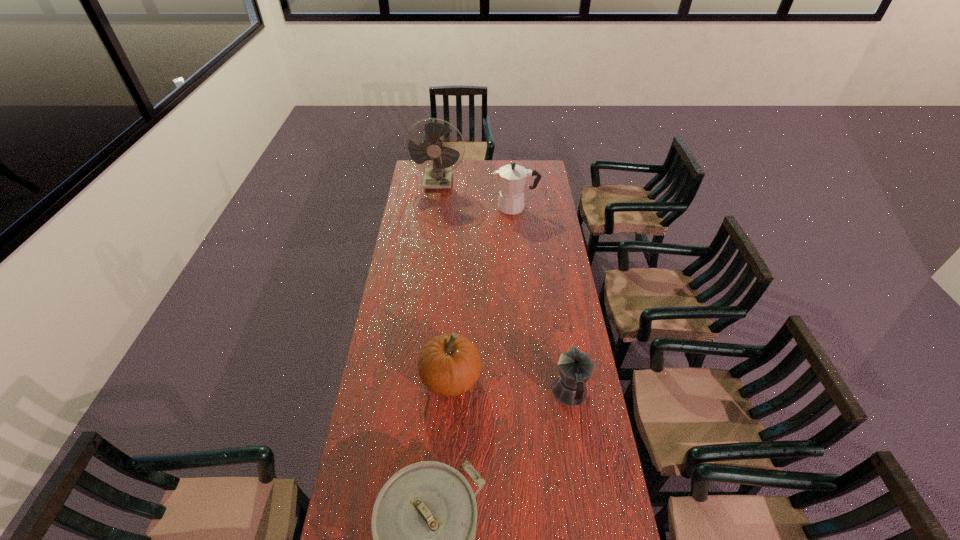
Identify the location of vacant space that satisfies the following two spatial constraints: 1. at the spout of the nearer coffeepot; 2. at the spout of the taller coffeepot. (540, 207).

The image size is (960, 540). Find the location of `free point that satisfies the following two spatial constraints: 1. at the spout of the nearer coffeepot; 2. at the spout of the farther coffeepot`. free point that satisfies the following two spatial constraints: 1. at the spout of the nearer coffeepot; 2. at the spout of the farther coffeepot is located at coordinates (540, 207).

This screenshot has height=540, width=960. Identify the location of vacant position in the image that satisfies the following two spatial constraints: 1. at the spout of the nearer coffeepot; 2. on the stem of the pumpkin. (567, 379).